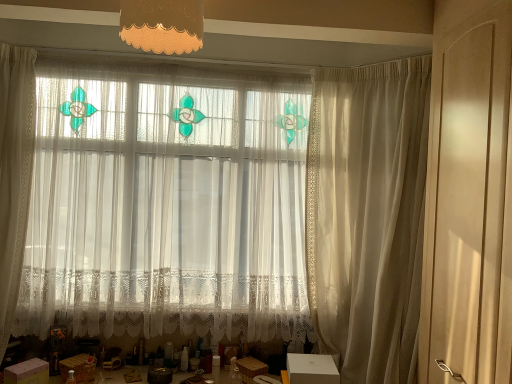
Question: In the image, is sheer white curtain at right, the 1th curtain positioned from the right, positioned in front of or behind white cardboard box at lower left, which is the 1th cardboard box in left-to-right order?

Choices:
 (A) front
 (B) behind

Answer: (A)

Question: Is sheer white curtain at right, which ranks as the second curtain in left-to-right order, taller or shorter than white cardboard box at lower left, which is the third cardboard box in right-to-left order?

Choices:
 (A) tall
 (B) short

Answer: (A)

Question: Estimate the real-world distances between objects in this image. Which object is farther from the matte brown cardboard box at lower left, which appears as the second cardboard box when viewed from the right?

Choices:
 (A) sheer white curtain at right, the 1th curtain positioned from the right
 (B) matte orange fabric lampshade at upper center
 (C) matte beige screen door at right
 (D) white cardboard box at lower left, which is the third cardboard box in right-to-left order
 (E) white cardboard box at lower center, the 3th cardboard box viewed from the left

Answer: (C)

Question: Based on their relative distances, which object is farther from the sheer white curtain at right, which ranks as the second curtain in left-to-right order?

Choices:
 (A) white cardboard box at lower center, which is the first cardboard box from right to left
 (B) matte brown cardboard box at lower left, acting as the second cardboard box starting from the left
 (C) matte orange fabric lampshade at upper center
 (D) matte beige screen door at right
 (E) white lace curtain at center, which is the 2th curtain from right to left

Answer: (B)